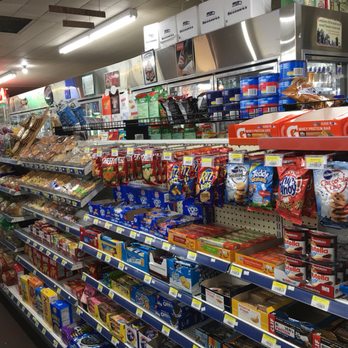
I want to click on store shelves, so click(202, 141), click(132, 141).